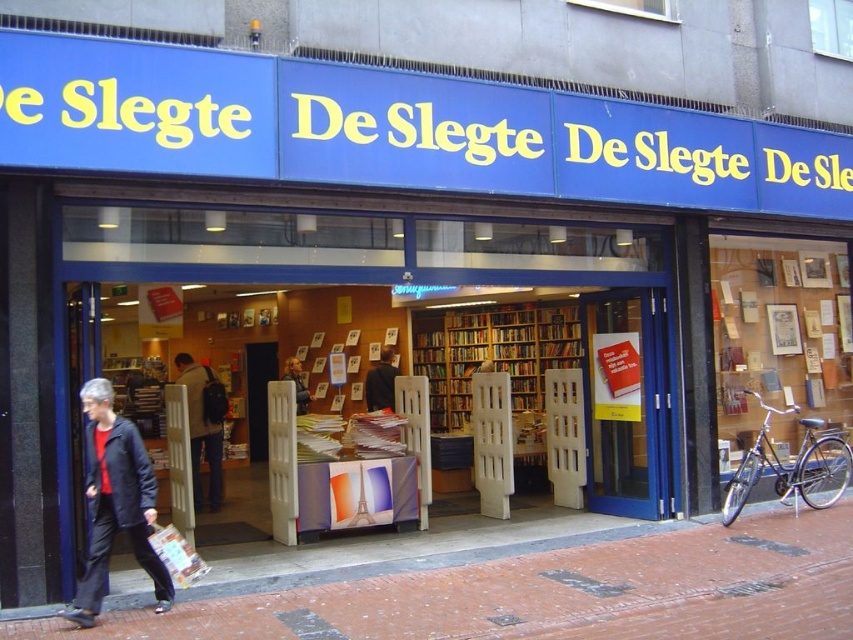
Question: Does wooden bookshelf at center appear on the right side of dark brown leather jacket at center?

Choices:
 (A) no
 (B) yes

Answer: (B)

Question: Which is farther from the black fabric jacket at lower left?

Choices:
 (A) dark brown leather jacket at center
 (B) wooden bookshelf at center

Answer: (B)

Question: Considering the real-world distances, which object is closest to the dark brown leather jacket at center?

Choices:
 (A) dark gray backpack at center
 (B) wooden bookshelf at center
 (C) smooth black jacket at center

Answer: (C)

Question: Which of the following is the closest to the observer?

Choices:
 (A) (463, 356)
 (B) (387, 406)
 (C) (300, 410)

Answer: (C)

Question: Can you confirm if black fabric jacket at lower left is thinner than dark brown leather jacket at center?

Choices:
 (A) no
 (B) yes

Answer: (A)

Question: Does black fabric jacket at lower left have a larger size compared to smooth black jacket at center?

Choices:
 (A) yes
 (B) no

Answer: (A)